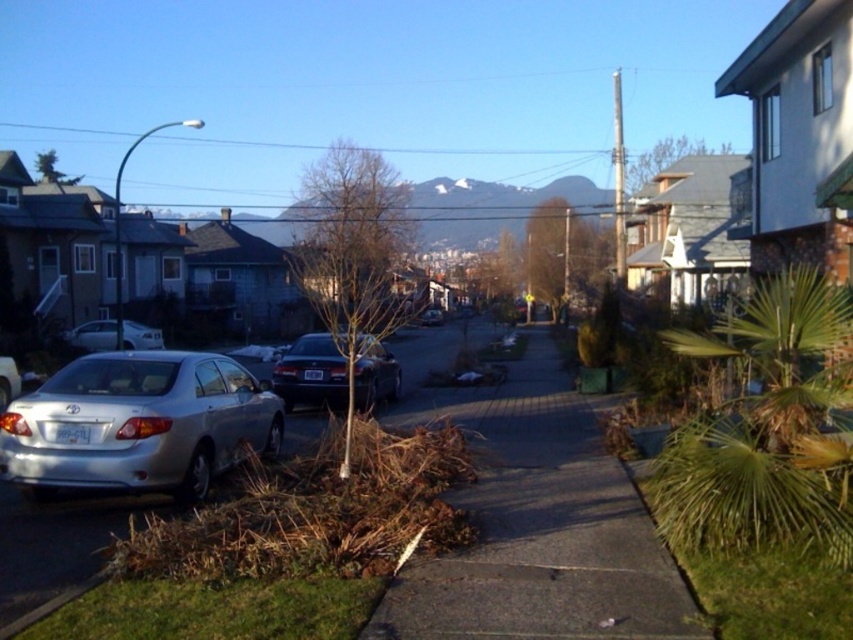
Is concrete sidewalk at center closer to the viewer compared to brown dry wood at lower left?

Yes, concrete sidewalk at center is closer to the viewer.

Can you confirm if concrete sidewalk at center is positioned above brown dry wood at lower left?

No, concrete sidewalk at center is not above brown dry wood at lower left.

This screenshot has width=853, height=640. Describe the element at coordinates (538, 525) in the screenshot. I see `concrete sidewalk at center` at that location.

Locate an element on the screen. The image size is (853, 640). concrete sidewalk at center is located at coordinates (538, 525).

Is point (338, 396) farther from viewer compared to point (433, 317)?

No, (338, 396) is closer to viewer.

Which of these two, shiny black sedan at center or satin black sedan at center, stands shorter?

shiny black sedan at center

Based on the photo, measure the distance between shiny black sedan at center and camera.

8.33 meters

Where is `shiny black sedan at center`? The height and width of the screenshot is (640, 853). shiny black sedan at center is located at coordinates (311, 372).

Is point (224, 554) positioned after point (77, 332)?

No, it is not.

Based on the photo, which is below, brown dry wood at lower left or satin silver sedan at left?

brown dry wood at lower left is lower down.

The width and height of the screenshot is (853, 640). What are the coordinates of `brown dry wood at lower left` in the screenshot? It's located at (316, 512).

Where is `brown dry wood at lower left`? The width and height of the screenshot is (853, 640). brown dry wood at lower left is located at coordinates (316, 512).